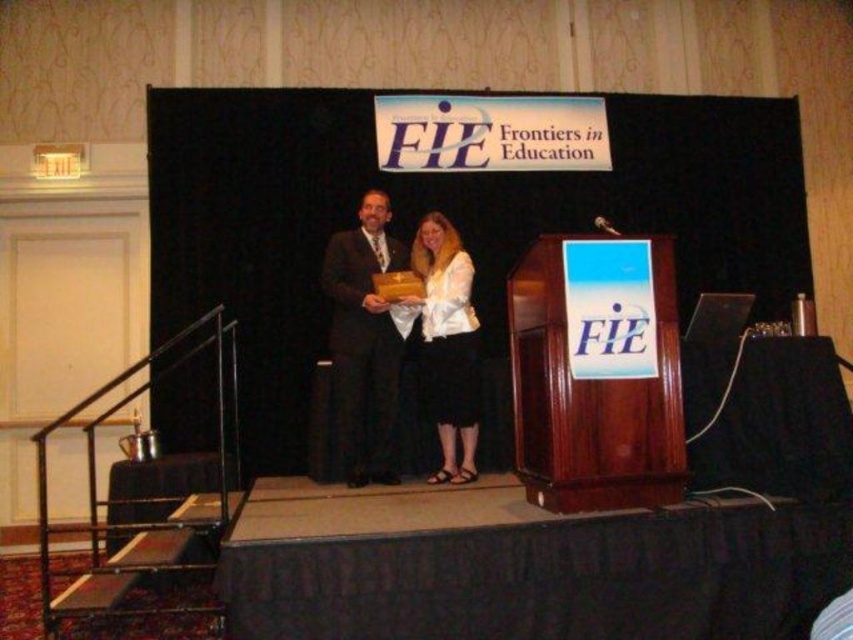
Question: Can you confirm if matte black suit at center is positioned to the right of matte white blouse at center?

Choices:
 (A) yes
 (B) no

Answer: (B)

Question: Does matte black suit at center come in front of matte white blouse at center?

Choices:
 (A) no
 (B) yes

Answer: (A)

Question: Which of the following is the farthest from the observer?

Choices:
 (A) (442, 440)
 (B) (345, 305)

Answer: (A)

Question: Can you confirm if matte black suit at center is bigger than matte white blouse at center?

Choices:
 (A) no
 (B) yes

Answer: (B)

Question: Among these objects, which one is farthest from the camera?

Choices:
 (A) matte black suit at center
 (B) matte white blouse at center

Answer: (A)

Question: Which of the following is the closest to the observer?

Choices:
 (A) (380, 243)
 (B) (404, 301)

Answer: (B)